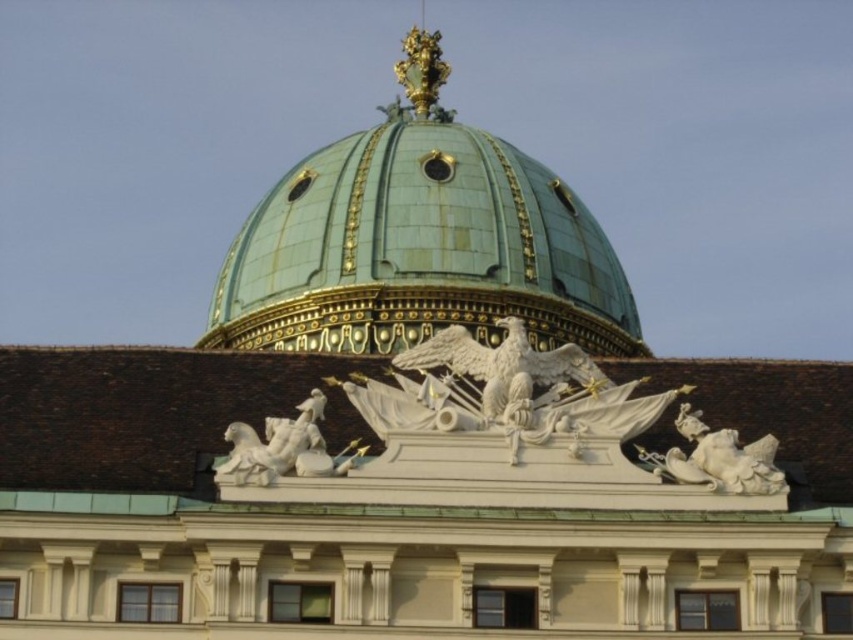
Question: Does green copper dome at upper center appear on the left side of white marble horse at center?

Choices:
 (A) yes
 (B) no

Answer: (A)

Question: Estimate the real-world distances between objects in this image. Which object is farther from the green copper dome at upper center?

Choices:
 (A) white marble reclining figure at upper right
 (B) white marble horse at center

Answer: (B)

Question: Which of the following is the closest to the observer?

Choices:
 (A) (778, 472)
 (B) (283, 432)
 (C) (543, 186)

Answer: (B)

Question: Is the position of white marble horse at center more distant than that of white marble reclining figure at upper right?

Choices:
 (A) yes
 (B) no

Answer: (B)

Question: Can you confirm if green copper dome at upper center is bigger than white marble horse at center?

Choices:
 (A) no
 (B) yes

Answer: (B)

Question: Which object is farther from the camera taking this photo?

Choices:
 (A) white marble reclining figure at upper right
 (B) green copper dome at upper center
 (C) white marble horse at center

Answer: (B)